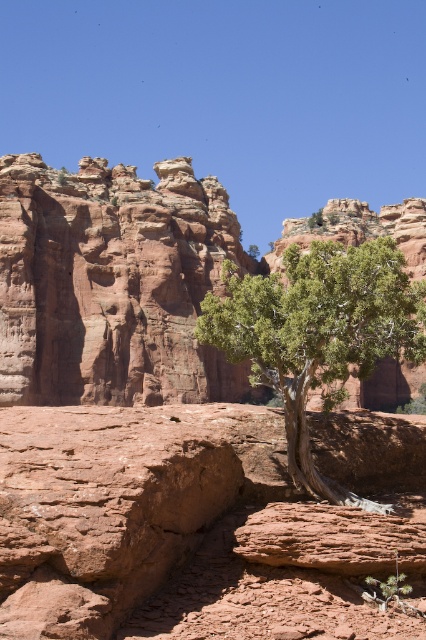
Question: Does rustic sandstone rock formation at center come behind green leafy tree at center?

Choices:
 (A) yes
 (B) no

Answer: (A)

Question: Is rustic sandstone rock formation at center behind green leafy tree at center?

Choices:
 (A) yes
 (B) no

Answer: (A)

Question: Which object is closer to the camera taking this photo?

Choices:
 (A) green leafy tree at center
 (B) rustic sandstone rock formation at center

Answer: (A)

Question: Does rustic sandstone rock formation at center have a smaller size compared to green leafy tree at center?

Choices:
 (A) yes
 (B) no

Answer: (B)